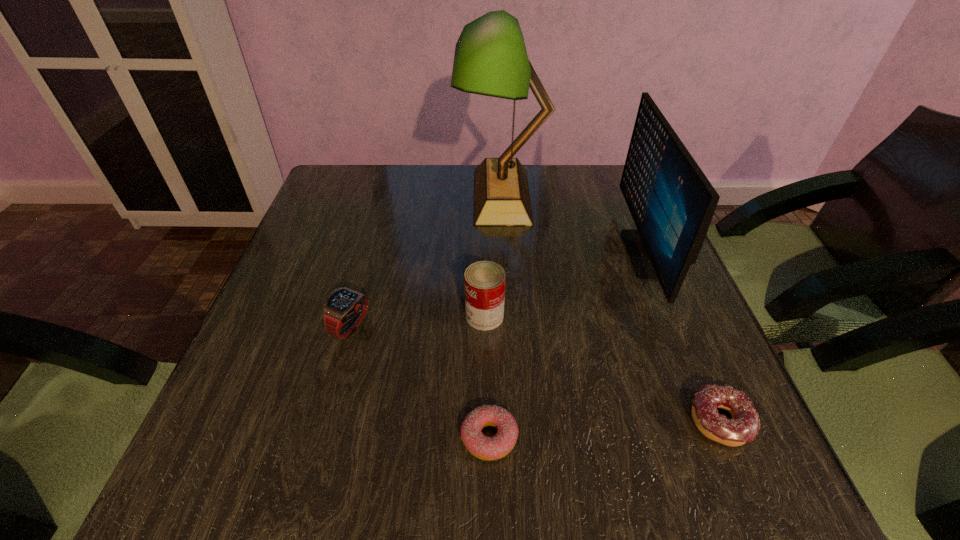
You are a GUI agent. You are given a task and a screenshot of the screen. Output one action in this format:
    pyautogui.click(x=<x>, y=<y>)
    Task: Click on the vacant space that satisfies the following two spatial constraints: 1. on the metallic stand of the tallest object; 2. on the left side of the right doughnut
    Image resolution: width=960 pixels, height=540 pixels.
    Given the screenshot: What is the action you would take?
    pyautogui.click(x=516, y=421)

Find the location of `free location that satisfies the following two spatial constraints: 1. on the screen side of the computer monitor; 2. on the front side of the leftmost object`. free location that satisfies the following two spatial constraints: 1. on the screen side of the computer monitor; 2. on the front side of the leftmost object is located at coordinates (677, 326).